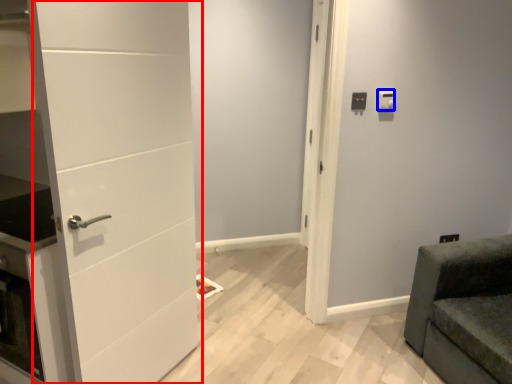
Question: Which of the following is the closest to the observer, door (highlighted by a red box) or light switch (highlighted by a blue box)?

Choices:
 (A) door
 (B) light switch

Answer: (A)